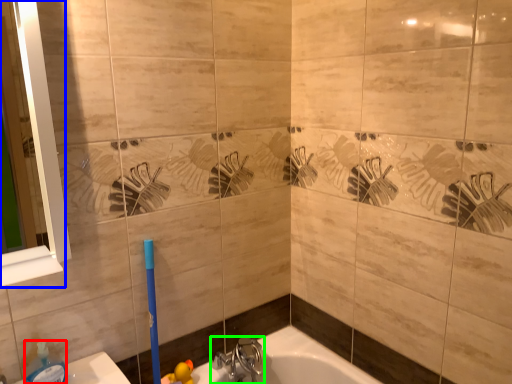
Question: Which is nearer to the soap dispenser (highlighted by a red box)? mirror (highlighted by a blue box) or tap (highlighted by a green box).

Choices:
 (A) mirror
 (B) tap

Answer: (A)